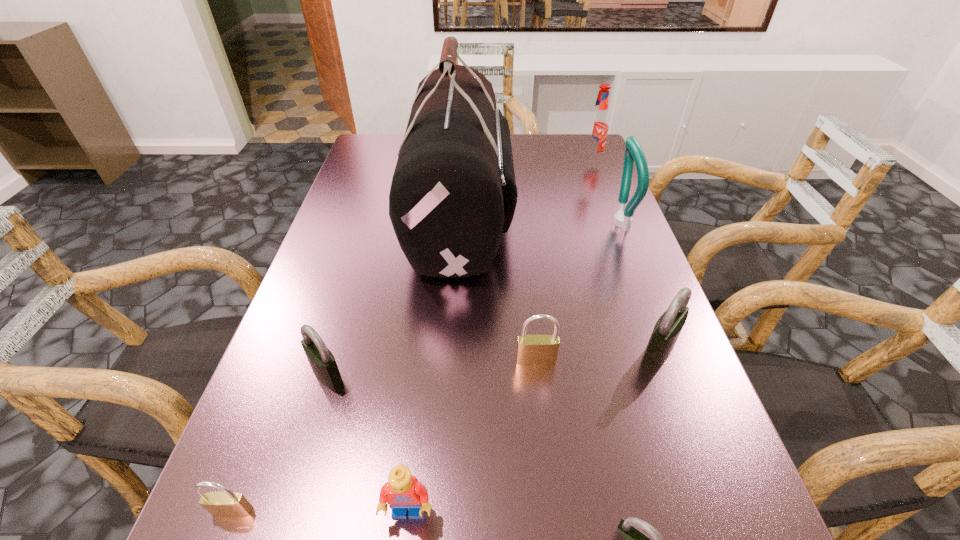
Identify which black padlock is the third closest to the duffel bag. Please provide its 2D coordinates. Your answer should be formatted as a tuple, i.e. [(x, y)], where the tuple contains the x and y coordinates of a point satisfying the conditions above.

[(627, 539)]

Image resolution: width=960 pixels, height=540 pixels. I want to click on free point that satisfies the following two spatial constraints: 1. on the back side of the eighth object from right to left; 2. on the right side of the red root beer, so click(x=391, y=161).

Locate an element on the screen. free spot that satisfies the following two spatial constraints: 1. on the back side of the red root beer; 2. on the left side of the leftmost black padlock is located at coordinates (391, 161).

This screenshot has height=540, width=960. What are the coordinates of `free location that satisfies the following two spatial constraints: 1. at the jaws of the bottle opener; 2. on the front-facing side of the leftmost padlock` in the screenshot? It's located at [730, 511].

The image size is (960, 540). Find the location of `vacant position in the image that satisfies the following two spatial constraints: 1. on the front pocket of the sixth shortest object; 2. on the left side of the duffel bag`. vacant position in the image that satisfies the following two spatial constraints: 1. on the front pocket of the sixth shortest object; 2. on the left side of the duffel bag is located at coordinates (453, 351).